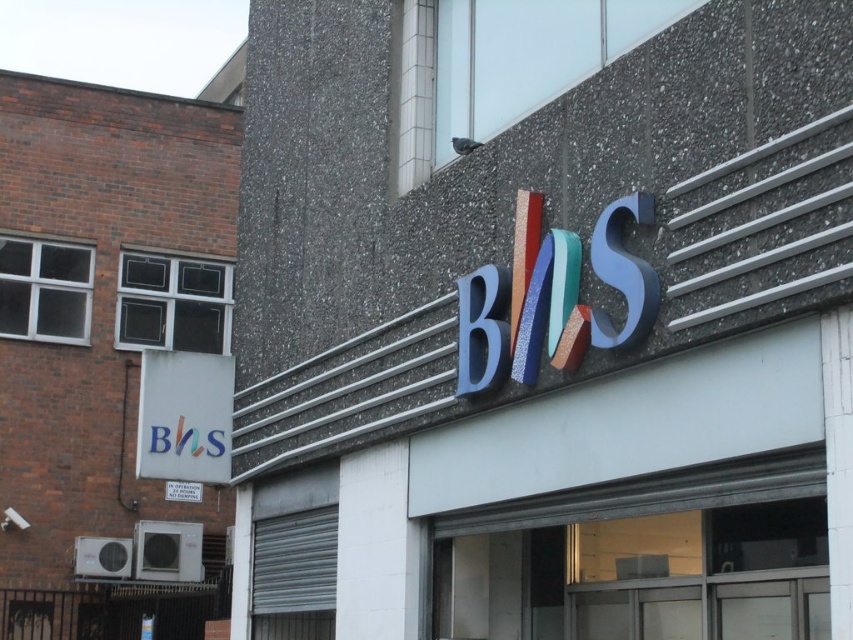
You are standing in front of the building and want to read both signs. Which sign should you look at first to ensure you can see the multicolored plastic sign at center clearly before moving closer to the matte white sign at lower left?

You should look at the multicolored plastic sign at center first because it is closer to you than the matte white sign at lower left, so you can see it clearly from your current position before moving closer to the matte white sign at lower left.